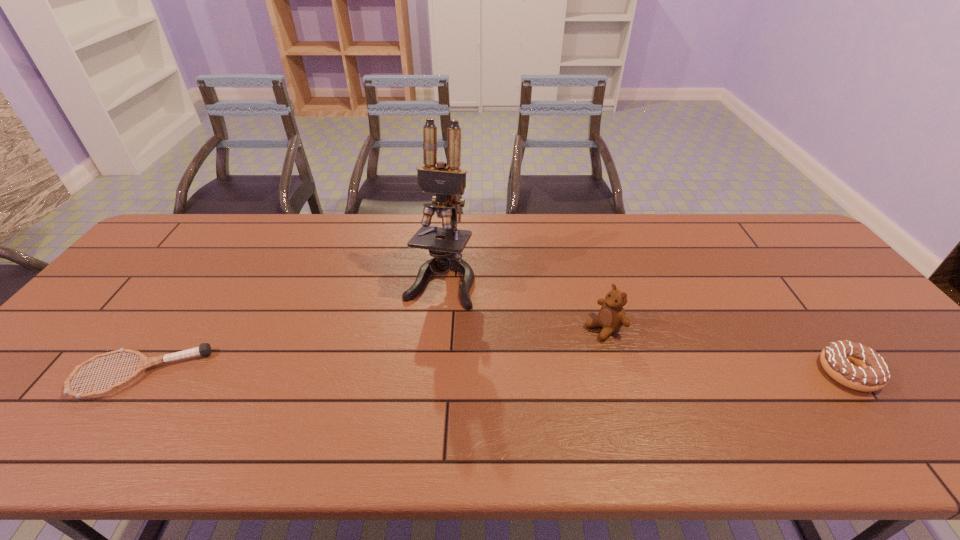
At what (x,y) coordinates should I click in order to perform the action: click on object located in the right edge section of the desktop. Please return your answer as a coordinate pair (x, y). This screenshot has width=960, height=540. Looking at the image, I should click on (854, 365).

This screenshot has height=540, width=960. Identify the location of object at the near left corner. (204, 349).

What are the coordinates of `object located at the near right corner` in the screenshot? It's located at (854, 365).

Locate an element on the screen. This screenshot has height=540, width=960. free region at the far edge of the desktop is located at coordinates (331, 228).

In the image, there is a desktop. Where is `blank space at the near edge`? This screenshot has width=960, height=540. blank space at the near edge is located at coordinates (178, 400).

The height and width of the screenshot is (540, 960). I want to click on vacant space at the left edge of the desktop, so click(x=63, y=376).

Identify the location of vacant area that lies between the shortest object and the second object from left to right. (290, 327).

The height and width of the screenshot is (540, 960). Identify the location of free space between the second object from right to left and the doughnut. (726, 349).

Image resolution: width=960 pixels, height=540 pixels. What are the coordinates of `vacant region between the tennis racket and the second tallest object` in the screenshot? It's located at (372, 351).

At what (x,y) coordinates should I click in order to perform the action: click on unoccupied position between the second tallest object and the tennis racket. Please return your answer as a coordinate pair (x, y). The width and height of the screenshot is (960, 540). Looking at the image, I should click on (372, 351).